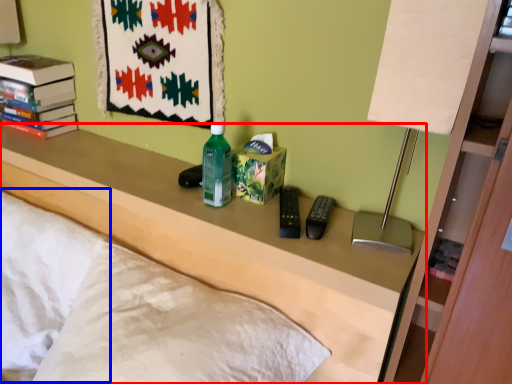
Question: Which point is further to the camera, furniture (highlighted by a red box) or pillow (highlighted by a blue box)?

Choices:
 (A) furniture
 (B) pillow

Answer: (B)